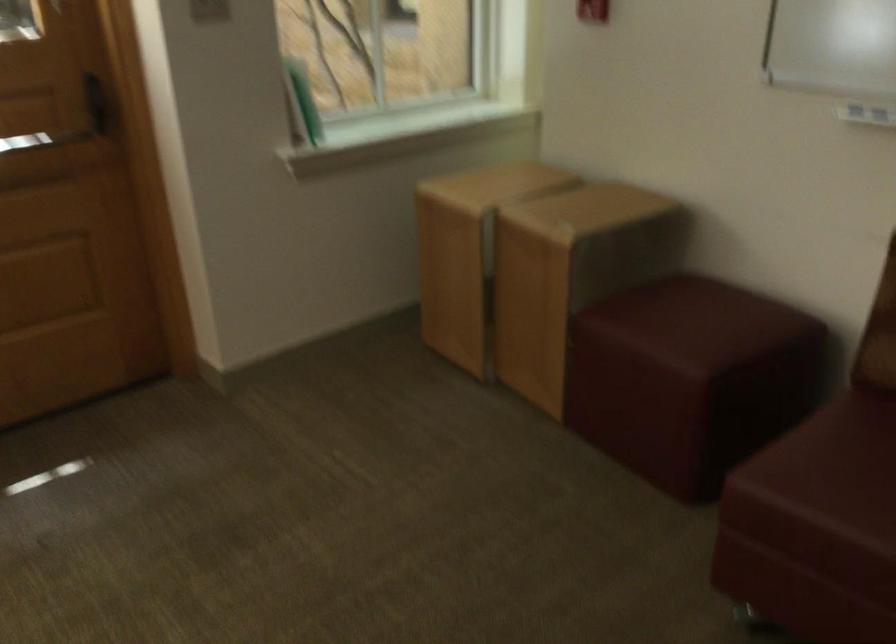
Describe the element at coordinates (823, 477) in the screenshot. This screenshot has width=896, height=644. I see `the sofa sitting surface` at that location.